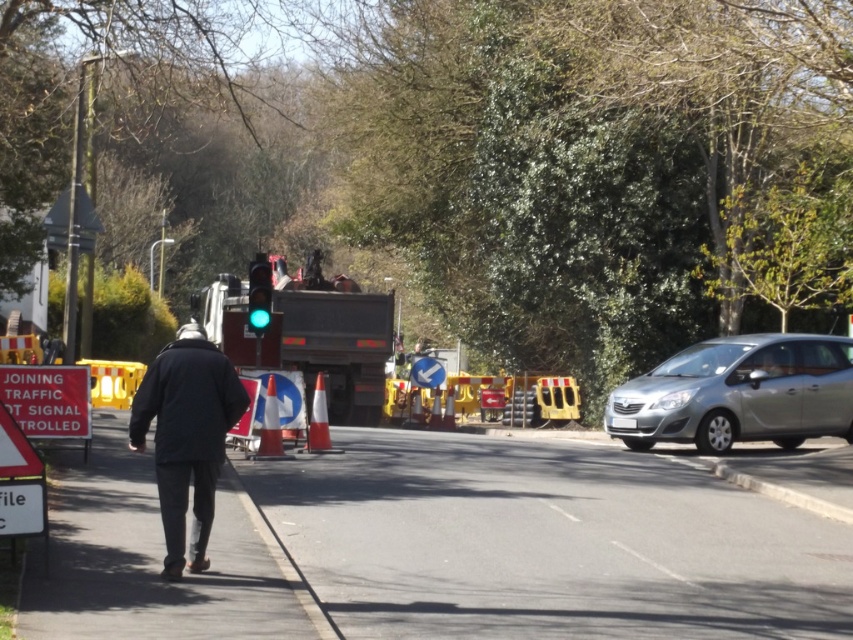
Question: Does red plastic sign at left have a smaller size compared to green glass traffic light at center?

Choices:
 (A) no
 (B) yes

Answer: (B)

Question: Which of the following is the farthest from the observer?

Choices:
 (A) dark blue jacket at center
 (B) white plastic arrow at center

Answer: (B)

Question: Can you confirm if red plastic sign at left is positioned to the left of green glass traffic light at center?

Choices:
 (A) yes
 (B) no

Answer: (A)

Question: Estimate the real-world distances between objects in this image. Which object is farther from the dark blue jacket at center?

Choices:
 (A) white plastic arrow at center
 (B) silver metallic car at right
 (C) green glass traffic light at center

Answer: (A)

Question: Which of the following is the closest to the observer?

Choices:
 (A) silver metallic car at right
 (B) red plastic sign at left

Answer: (B)

Question: Does red plastic sign at left come behind white plastic arrow at center?

Choices:
 (A) no
 (B) yes

Answer: (A)